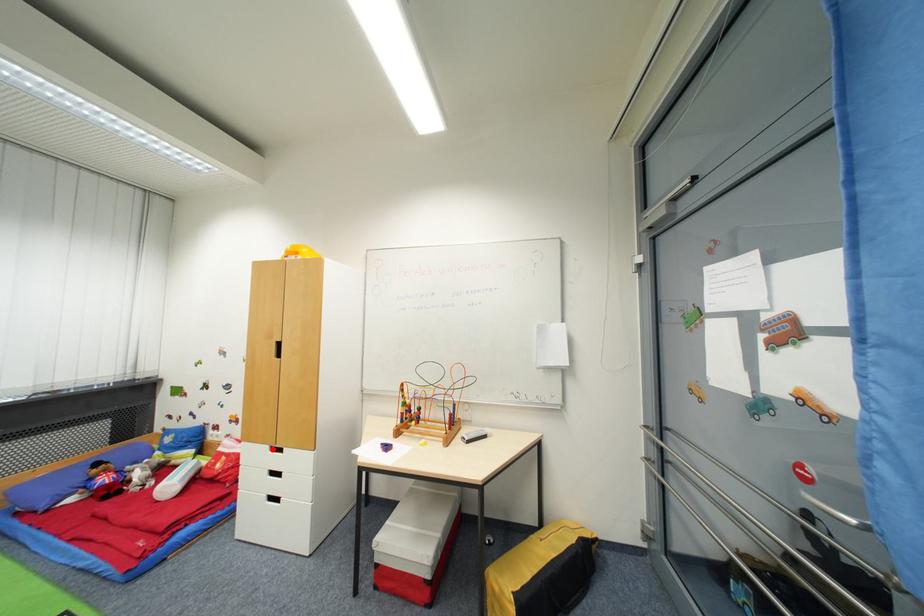
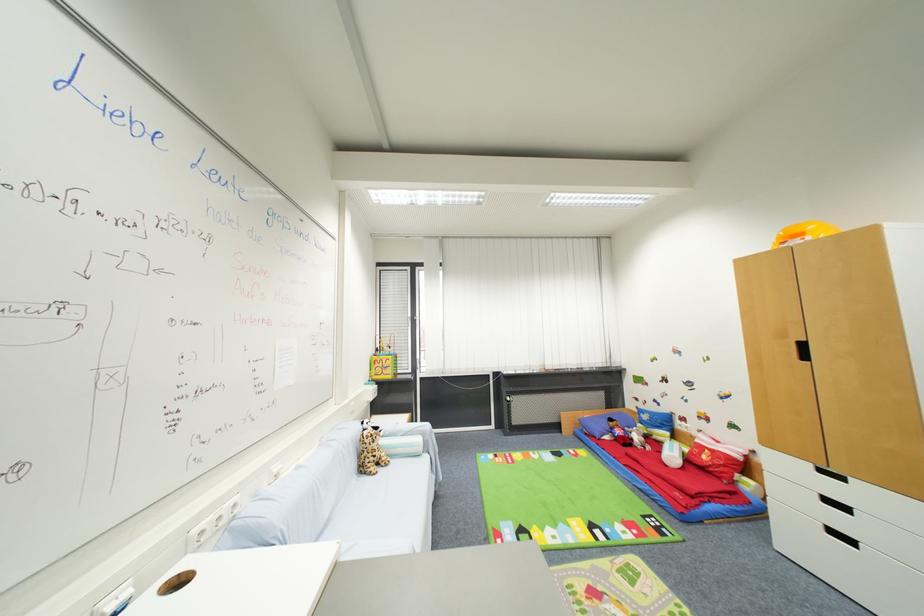
Where in the second image is the point corresponding to the highlighted location from the first image?

(816, 467)